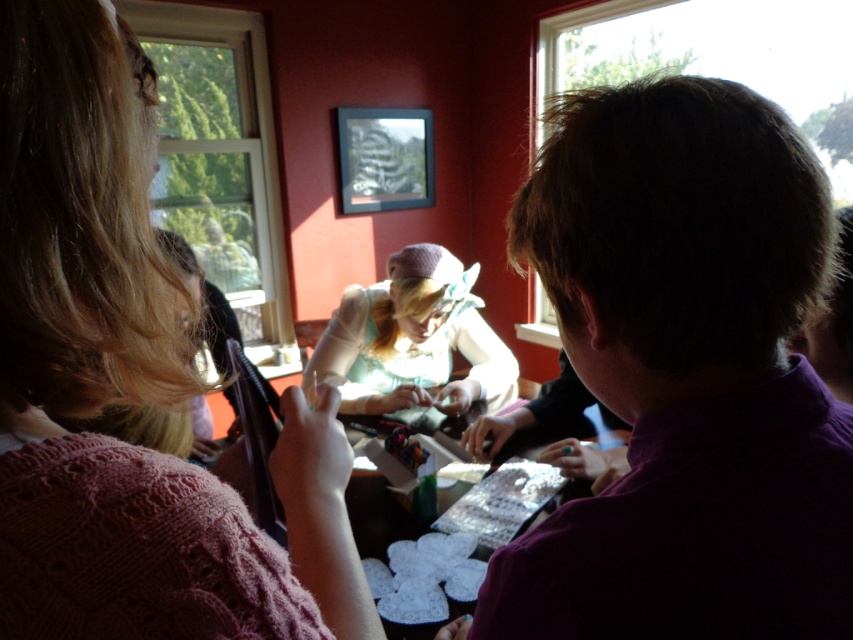
Question: From the image, what is the correct spatial relationship of purple shirt at right in relation to light blue fabric at center?

Choices:
 (A) left
 (B) right

Answer: (B)

Question: Which point is closer to the camera?

Choices:
 (A) (606, 344)
 (B) (418, 292)
 (C) (111, 516)

Answer: (C)

Question: Among these objects, which one is nearest to the camera?

Choices:
 (A) purple shirt at right
 (B) knitted pink sweater at left
 (C) light blue fabric at center

Answer: (B)

Question: Which object is farther from the camera taking this photo?

Choices:
 (A) knitted pink sweater at left
 (B) light blue fabric at center
 (C) purple shirt at right

Answer: (B)

Question: Does purple shirt at right have a greater width compared to light blue fabric at center?

Choices:
 (A) no
 (B) yes

Answer: (A)

Question: Is purple shirt at right positioned at the back of knitted pink sweater at left?

Choices:
 (A) no
 (B) yes

Answer: (B)